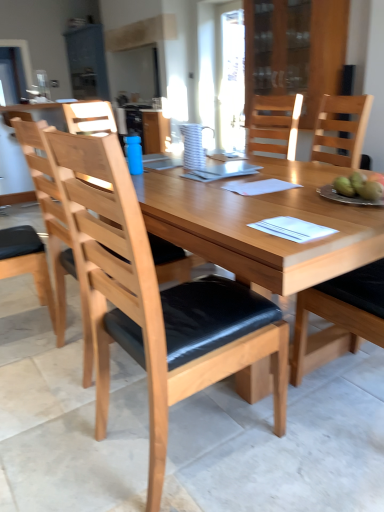
This screenshot has width=384, height=512. Identify the location of free region under light wood/black cushion chair at center, the 2th chair viewed from the left (from a real-world perspective). (185, 446).